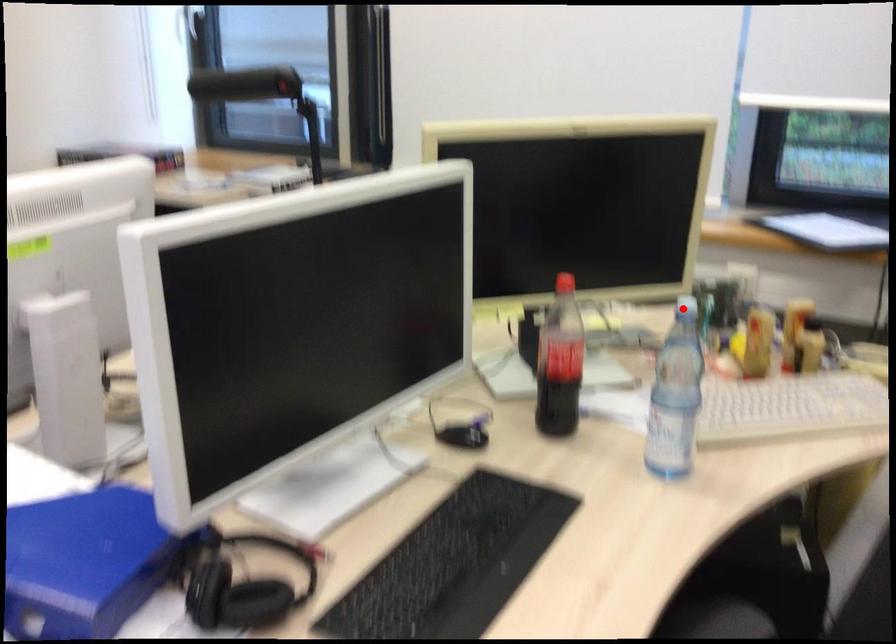
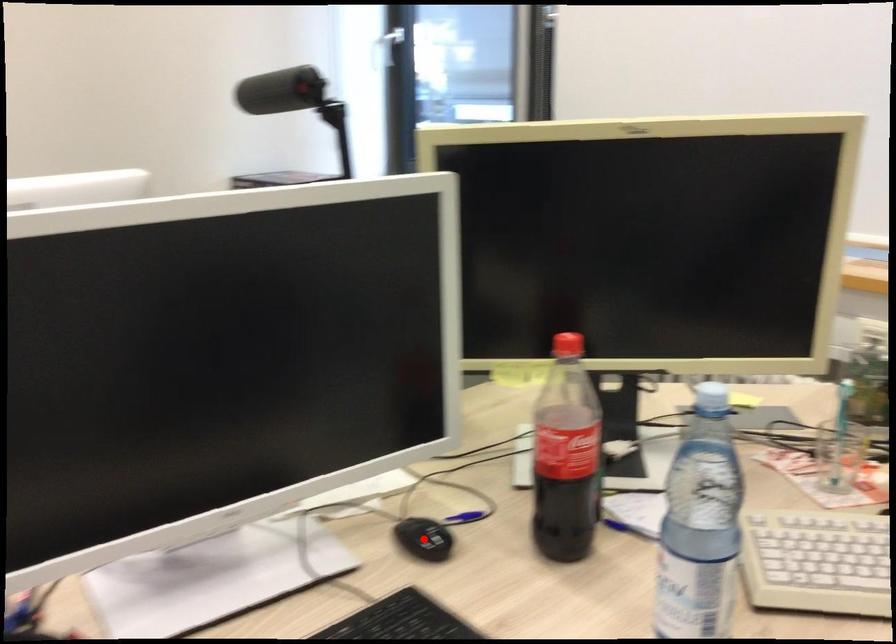
I am providing you with two images of the same scene from different viewpoints. A red point is marked on the first image and another point is marked on the second image. Do the highlighted points in image1 and image2 indicate the same real-world spot?

No